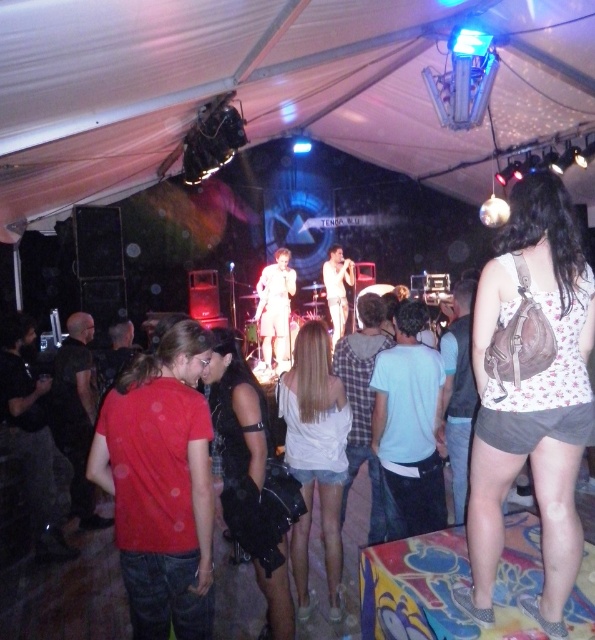
Question: Can you confirm if floral-patterned fabric top at center-right is bigger than white glossy shirt at center?

Choices:
 (A) yes
 (B) no

Answer: (B)

Question: Considering the real-world distances, which object is closest to the red cotton t-shirt at left?

Choices:
 (A) white fabric shirt at center
 (B) floral-patterned fabric top at center-right

Answer: (B)

Question: Estimate the real-world distances between objects in this image. Which object is closer to the red cotton t-shirt at left?

Choices:
 (A) white fabric shirt at center
 (B) white matte shorts at center

Answer: (B)

Question: Does white fabric shirt at center have a larger size compared to white glossy shirt at center?

Choices:
 (A) no
 (B) yes

Answer: (B)

Question: Among these objects, which one is farthest from the camera?

Choices:
 (A) red cotton t-shirt at left
 (B) white glossy shirt at center
 (C) white matte shorts at center
 (D) floral-patterned fabric top at center-right

Answer: (B)

Question: Does white matte shorts at center appear over white glossy shirt at center?

Choices:
 (A) no
 (B) yes

Answer: (A)